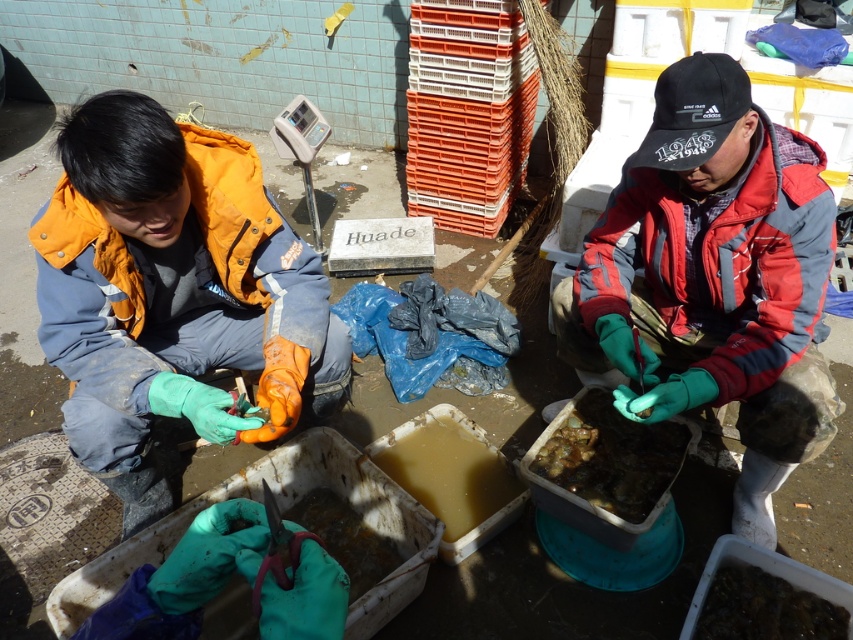
Is the position of red and gray jacket at center more distant than that of brown rubber food at lower center?

No, red and gray jacket at center is closer to the viewer.

Is point (718, 371) closer to camera compared to point (283, 512)?

Yes.

Image resolution: width=853 pixels, height=640 pixels. Identify the location of red and gray jacket at center. (712, 278).

Consider the image. Can you confirm if brown translucent liquid at center is thinner than brown rubbery food at center?

No.

Can you confirm if brown translucent liquid at center is positioned below brown rubbery food at center?

Yes.

Which is in front, point (467, 486) or point (677, 451)?

Point (677, 451)

Identify the location of brown translucent liquid at center. This screenshot has width=853, height=640. (451, 474).

Find the location of a particular element. Image resolution: width=853 pixels, height=640 pixels. brown translucent liquid at center is located at coordinates (451, 474).

Does brown translucent liquid at center appear under dark brown rubbery food at lower right?

Incorrect, brown translucent liquid at center is not positioned below dark brown rubbery food at lower right.

Where is `brown translucent liquid at center`? The height and width of the screenshot is (640, 853). brown translucent liquid at center is located at coordinates (451, 474).

This screenshot has height=640, width=853. Identify the location of brown translucent liquid at center. (451, 474).